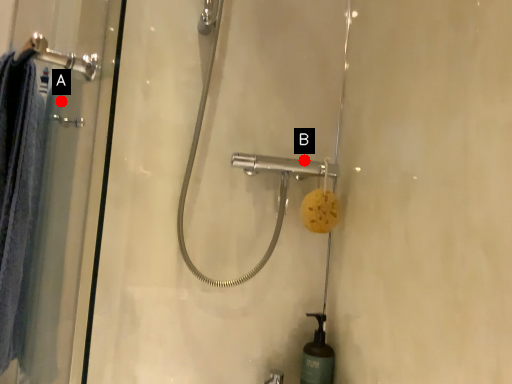
Question: Two points are circled on the image, labeled by A and B beside each circle. Which point appears closest to the camera in this image?

Choices:
 (A) A is closer
 (B) B is closer

Answer: (A)